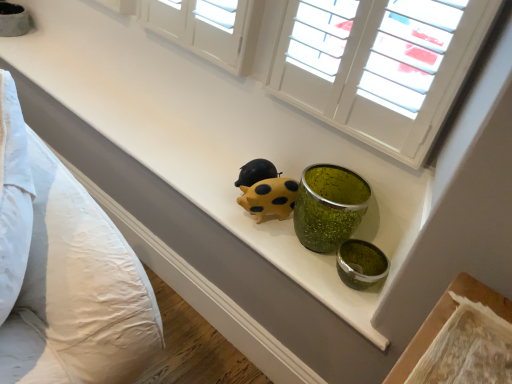
The image size is (512, 384). I want to click on vacant region to the left of yellow matte rubber ladybug at center, so click(x=214, y=190).